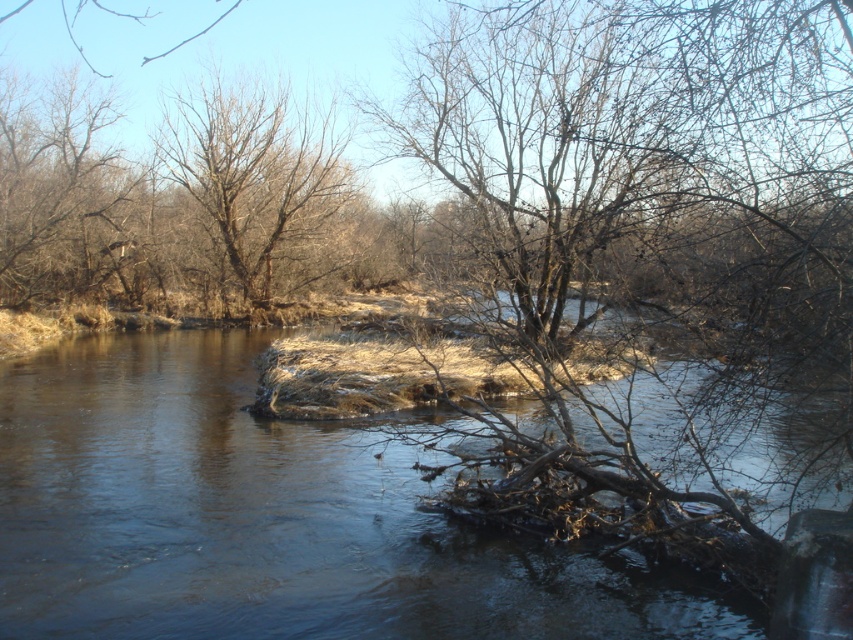
You are standing at the edge of the river and want to cross it using a small boat. The boat can only be placed on the clear water at center. Based on the coordinates provided, where should you place the boat to ensure safe passage?

The clear water at center is located at coordinates point (x=267, y=518), so you should place the boat there to ensure safe passage.